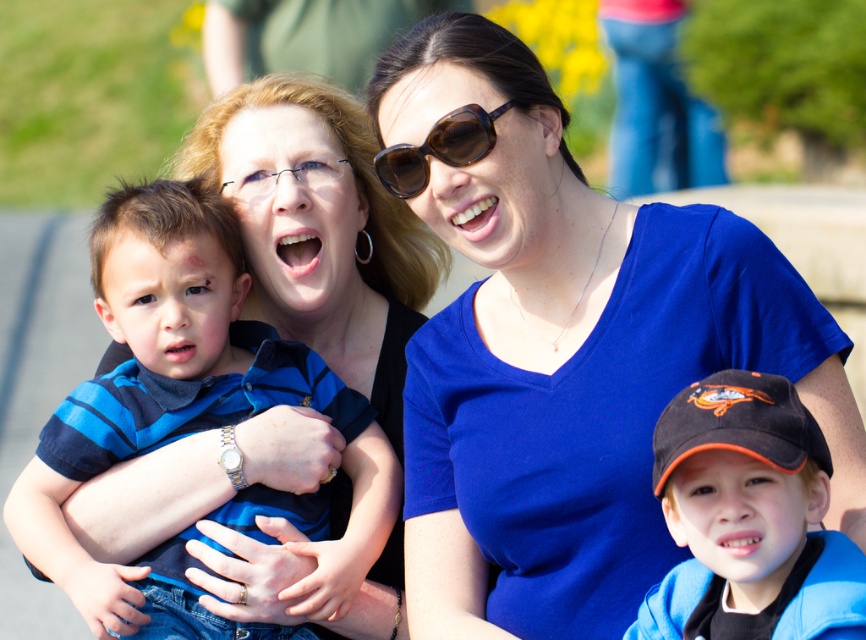
Question: Which of these objects is positioned closest to the brown matte sunglasses at upper center?

Choices:
 (A) black matte baseball cap at lower right
 (B) blue striped shirt at left
 (C) blue matte shirt at center

Answer: (C)

Question: Is blue striped shirt at left smaller than brown matte sunglasses at upper center?

Choices:
 (A) no
 (B) yes

Answer: (A)

Question: Can you confirm if blue striped shirt at left is positioned to the right of black matte baseball cap at lower right?

Choices:
 (A) no
 (B) yes

Answer: (A)

Question: Considering the real-world distances, which object is closest to the blue striped shirt at left?

Choices:
 (A) blue matte shirt at center
 (B) brown matte sunglasses at upper center

Answer: (A)

Question: Is blue matte shirt at center below black matte baseball cap at lower right?

Choices:
 (A) yes
 (B) no

Answer: (B)

Question: Which point is closer to the camera taking this photo?

Choices:
 (A) (441, 372)
 (B) (115, 595)
 (C) (848, 566)
 (D) (433, 128)

Answer: (C)